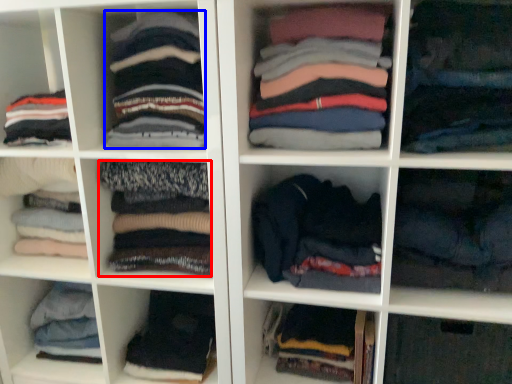
Question: Among these objects, which one is nearest to the camera, clothing (highlighted by a red box) or clothing (highlighted by a blue box)?

Choices:
 (A) clothing
 (B) clothing

Answer: (B)